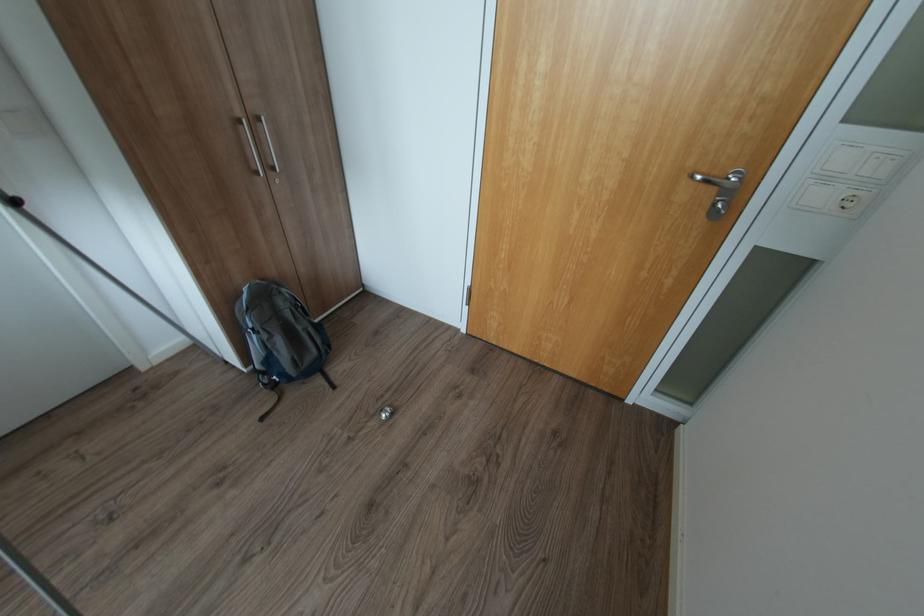
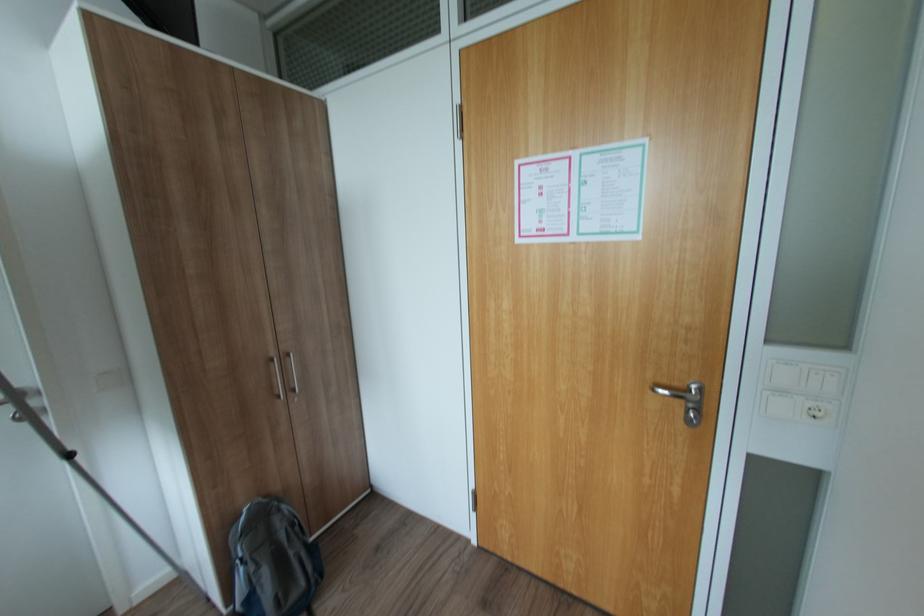
In the second image, find the point that corresponds to [703,177] in the first image.

(664, 390)